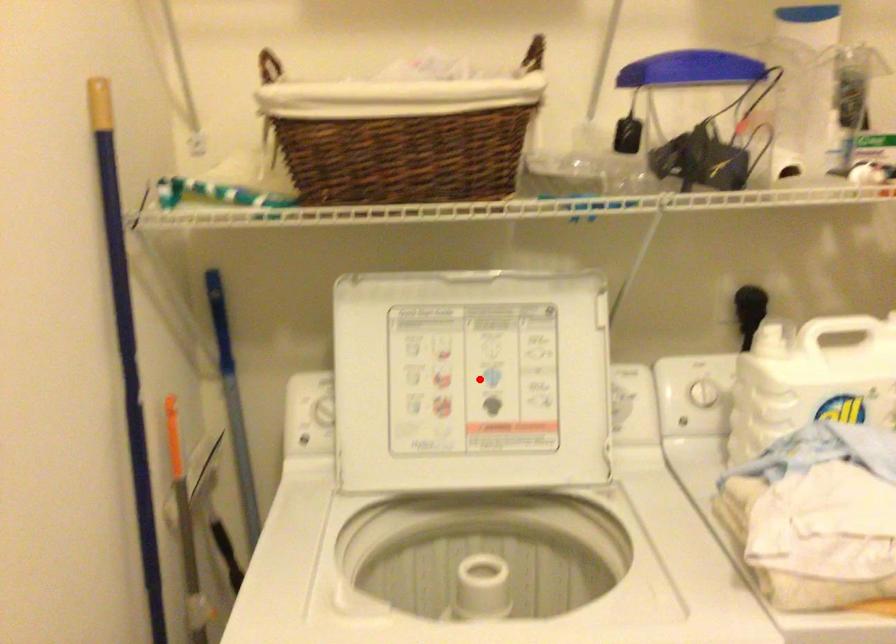
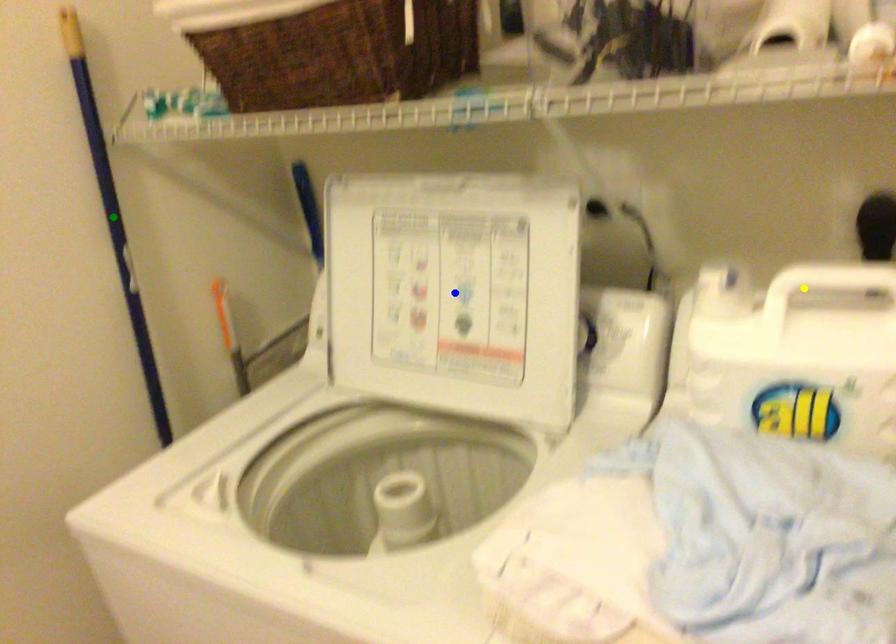
Question: I am providing you with two images of the same scene from different viewpoints. A red point is marked on the first image. You are given multiple points on the second image. Which point in image 2 is actually the same real-world point as the red point in image 1?

Choices:
 (A) yellow point
 (B) green point
 (C) blue point

Answer: (C)